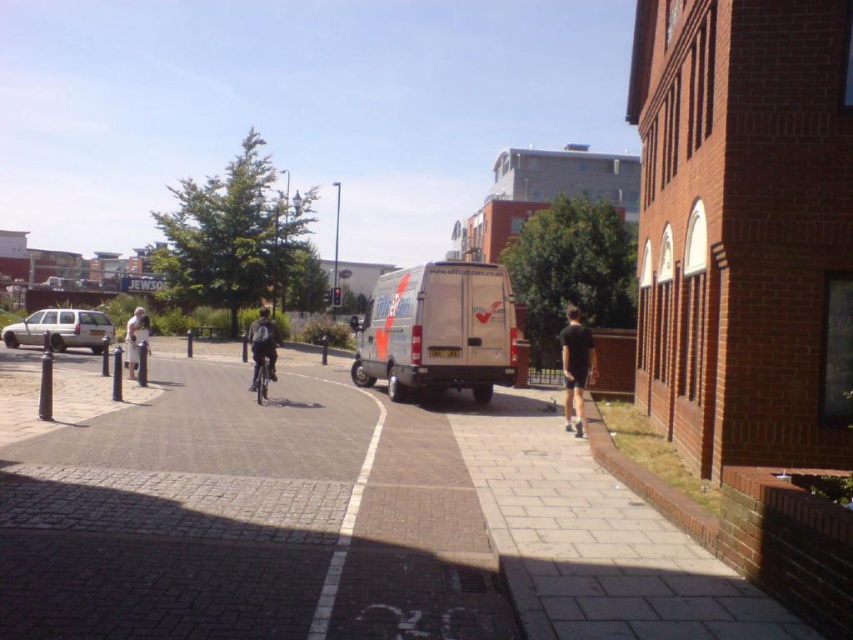
Question: Is dark blue jacket at center smaller than light beige jacket at center-left?

Choices:
 (A) yes
 (B) no

Answer: (A)

Question: Which object is the farthest from the brick pavement at center?

Choices:
 (A) dark blue jacket at center
 (B) black fabric shorts at center-right

Answer: (A)

Question: Which of the following is the farthest from the observer?

Choices:
 (A) (82, 324)
 (B) (572, 349)

Answer: (A)

Question: Is beige matte van at center above shiny metallic bicycle at center?

Choices:
 (A) no
 (B) yes

Answer: (B)

Question: Is black fabric shorts at center-right smaller than light beige jacket at center-left?

Choices:
 (A) no
 (B) yes

Answer: (B)

Question: Which point is closer to the camera taking this photo?

Choices:
 (A) (256, 320)
 (B) (129, 358)
 (C) (593, 356)

Answer: (C)